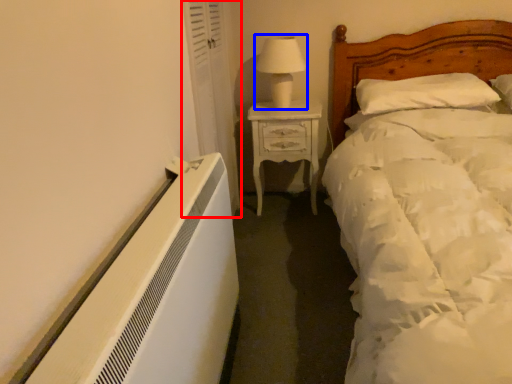
Question: Which of the following is the farthest to the observer, curtain (highlighted by a red box) or table lamp (highlighted by a blue box)?

Choices:
 (A) curtain
 (B) table lamp

Answer: (B)